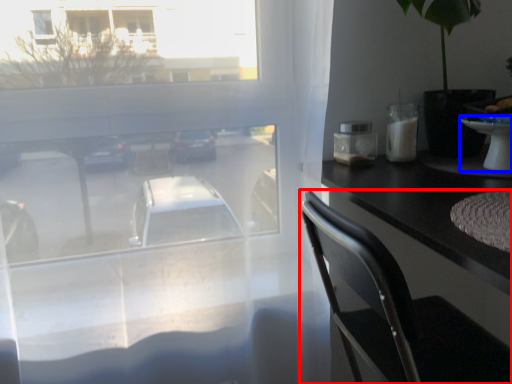
Question: Which object is further to the camera taking this photo, chair (highlighted by a red box) or table (highlighted by a blue box)?

Choices:
 (A) chair
 (B) table

Answer: (B)